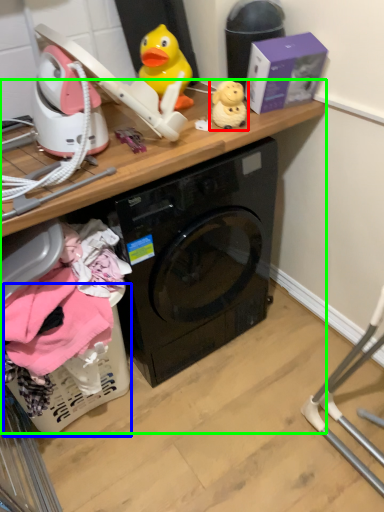
Question: Which object is the farthest from toy (highlighted by a red box)? Choose among these: basket (highlighted by a blue box) or computer desk (highlighted by a green box).

Choices:
 (A) basket
 (B) computer desk

Answer: (A)